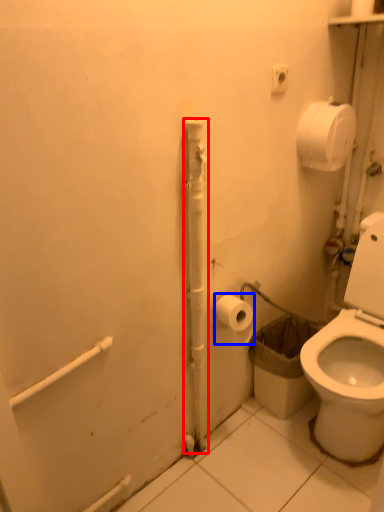
Question: Which object is further to the camera taking this photo, pipe (highlighted by a red box) or toilet paper (highlighted by a blue box)?

Choices:
 (A) pipe
 (B) toilet paper

Answer: (B)